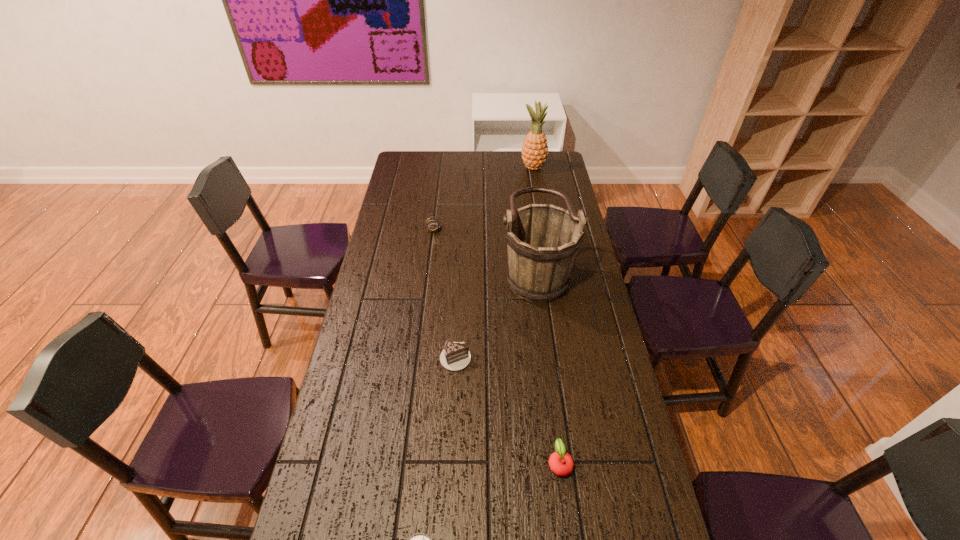
In the image, there is a desktop. Where is `vacant space at the left edge`? vacant space at the left edge is located at coordinates (409, 276).

This screenshot has width=960, height=540. In the image, there is a desktop. What are the coordinates of `vacant space at the right edge` in the screenshot? It's located at (612, 507).

Identify the location of vacant area that lies between the chocolate cake and the fifth farthest object. Image resolution: width=960 pixels, height=540 pixels. (508, 410).

Identify the location of free space between the farther compass and the tallest object. (484, 197).

Image resolution: width=960 pixels, height=540 pixels. Identify the location of free area in between the third farthest object and the second farthest object. (485, 248).

You are a GUI agent. You are given a task and a screenshot of the screen. Output one action in this format:
    pyautogui.click(x=<x>, y=<y>)
    Task: Click on the empty location between the fifth shortest object and the chocolate cake
    The height and width of the screenshot is (540, 960).
    Given the screenshot: What is the action you would take?
    pyautogui.click(x=495, y=314)

Locate an element on the screen. This screenshot has height=540, width=960. vacant space that's between the taller compass and the third nearest object is located at coordinates (444, 292).

Identify the location of vacant point located between the chocolate cake and the tallest object. (494, 262).

Find the location of `object that is the closest one to the fifth shortest object`. object that is the closest one to the fifth shortest object is located at coordinates (454, 357).

This screenshot has height=540, width=960. In order to click on object that ranks as the third closest to the fourth shortest object in this screenshot , I will do `click(454, 357)`.